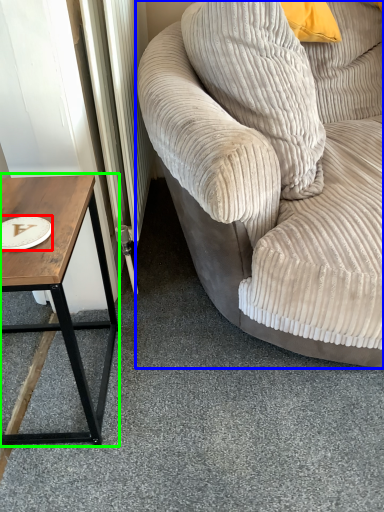
Question: Estimate the real-world distances between objects in this image. Which object is closer to paper plate (highlighted by a red box), studio couch (highlighted by a blue box) or coffee table (highlighted by a green box)?

Choices:
 (A) studio couch
 (B) coffee table

Answer: (B)